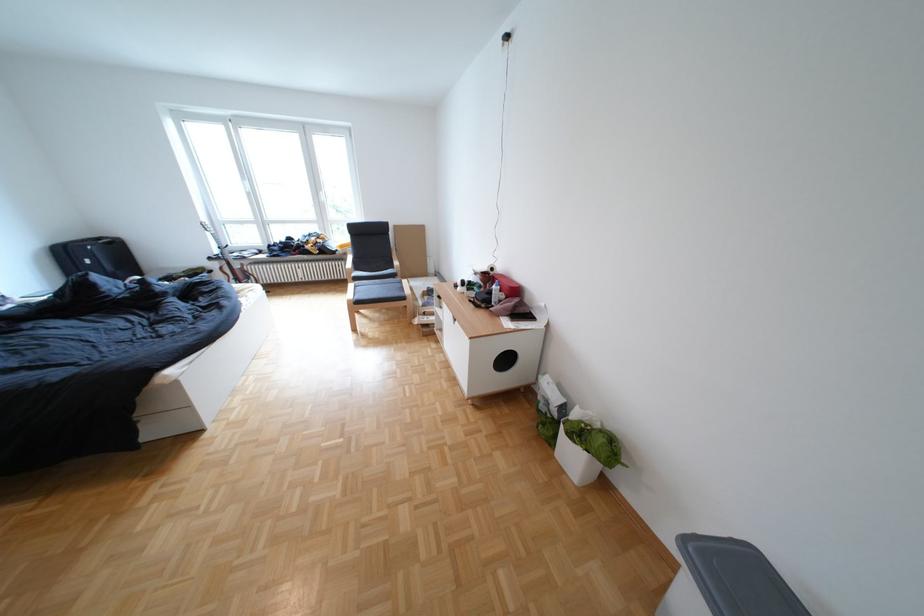
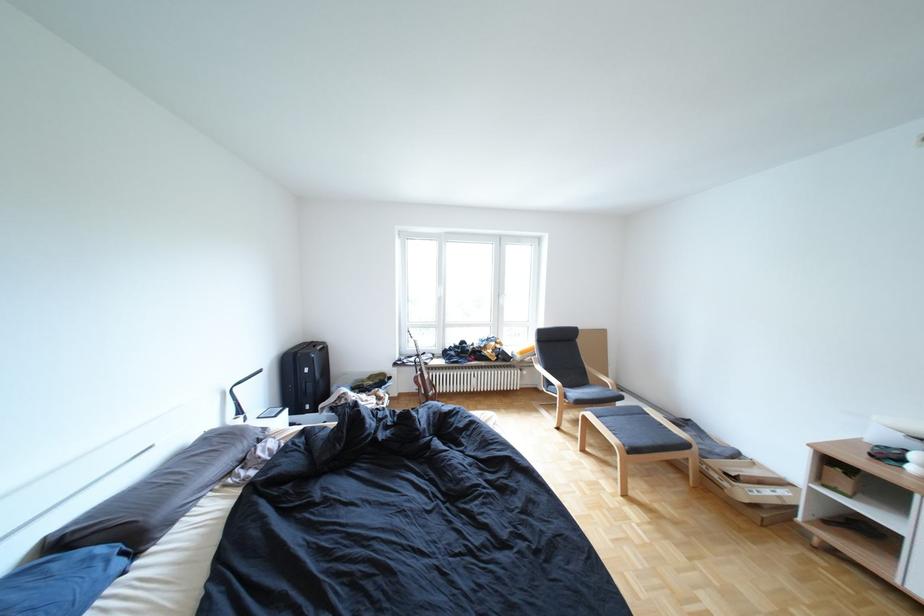
Question: The images are taken continuously from a first-person perspective. In which direction are you moving?

Choices:
 (A) Left
 (B) Right
 (C) Forward
 (D) Backward

Answer: (A)